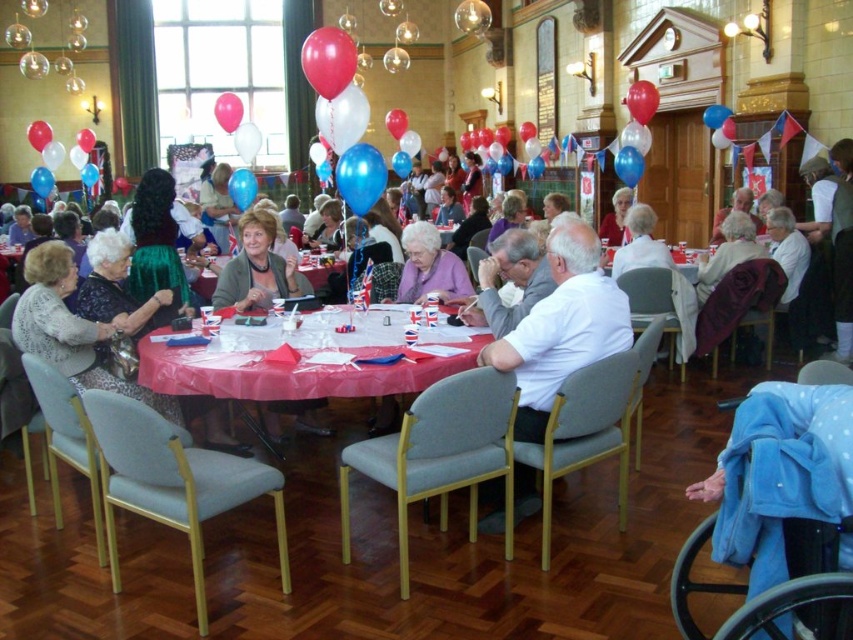
Is purple fabric at center bigger than rubberized white balloon at center?

Actually, purple fabric at center might be smaller than rubberized white balloon at center.

Find the location of a particular element. This screenshot has height=640, width=853. purple fabric at center is located at coordinates (428, 268).

Locate an element on the screen. Image resolution: width=853 pixels, height=640 pixels. purple fabric at center is located at coordinates (428, 268).

Between point (827, 444) and point (280, 436), which one is positioned behind?

Positioned behind is point (280, 436).

Does blue fabric wheelchair at lower right appear on the left side of matte gray sweater at center?

In fact, blue fabric wheelchair at lower right is to the right of matte gray sweater at center.

Which is in front, point (814, 499) or point (283, 406)?

Positioned in front is point (814, 499).

You are a GUI agent. You are given a task and a screenshot of the screen. Output one action in this format:
    pyautogui.click(x=<x>, y=<y>)
    Task: Click on the blue fabric wheelchair at lower right
    The image size is (853, 640).
    Given the screenshot: What is the action you would take?
    point(779,474)

Consider the image. Between blue fabric wheelchair at lower right and glossy blue balloon at upper center, which one is positioned higher?

glossy blue balloon at upper center is above.

Does blue fabric wheelchair at lower right appear on the right side of glossy blue balloon at upper center?

Incorrect, blue fabric wheelchair at lower right is not on the right side of glossy blue balloon at upper center.

Find the location of `blue fabric wheelchair at lower right`. blue fabric wheelchair at lower right is located at coordinates (779, 474).

This screenshot has width=853, height=640. In order to click on blue fabric wheelchair at lower right in this screenshot , I will do `click(779, 474)`.